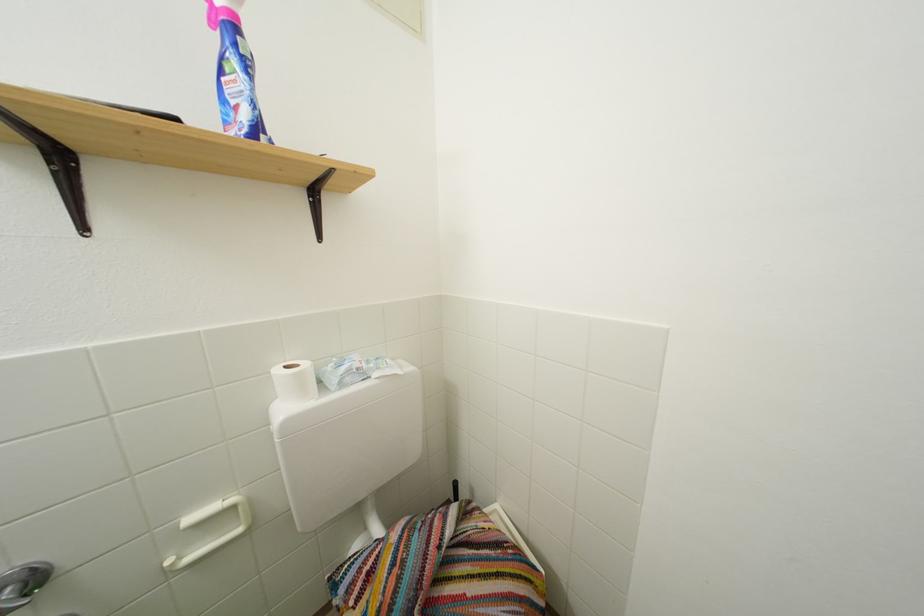
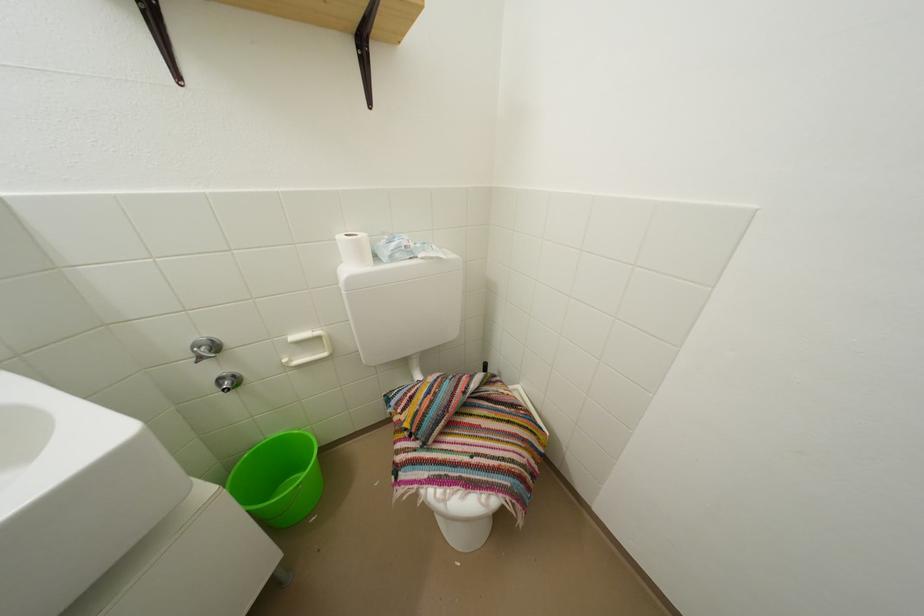
Where in the second image is the point corresponding to point (283, 377) from the first image?

(346, 243)